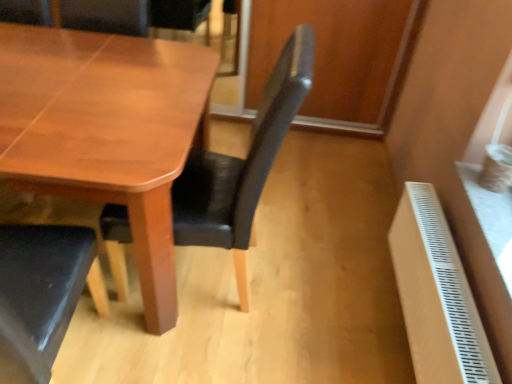
Question: Is wooden table at center facing away from satin black chair at center?

Choices:
 (A) no
 (B) yes

Answer: (A)

Question: From a real-world perspective, is wooden table at center located higher than satin black chair at center?

Choices:
 (A) yes
 (B) no

Answer: (B)

Question: Considering the relative positions of wooden table at center and satin black chair at center in the image provided, is wooden table at center to the left of satin black chair at center from the viewer's perspective?

Choices:
 (A) no
 (B) yes

Answer: (B)

Question: Can you confirm if wooden table at center is positioned to the right of satin black chair at center?

Choices:
 (A) no
 (B) yes

Answer: (A)

Question: Is satin black chair at center surrounded by wooden table at center?

Choices:
 (A) yes
 (B) no

Answer: (A)

Question: Is satin black chair at center in front of or behind white plastic radiator at lower right in the image?

Choices:
 (A) front
 (B) behind

Answer: (A)

Question: From a real-world perspective, is satin black chair at center above or below white plastic radiator at lower right?

Choices:
 (A) above
 (B) below

Answer: (A)

Question: Choose the correct answer: Is satin black chair at center inside white plastic radiator at lower right or outside it?

Choices:
 (A) inside
 (B) outside

Answer: (B)

Question: Is point (286, 119) closer or farther from the camera than point (433, 271)?

Choices:
 (A) closer
 (B) farther

Answer: (A)

Question: In terms of size, does wooden table at center appear bigger or smaller than satin black chair at center?

Choices:
 (A) small
 (B) big

Answer: (B)

Question: Considering their positions, is wooden table at center located in front of or behind satin black chair at center?

Choices:
 (A) front
 (B) behind

Answer: (B)

Question: From a real-world perspective, is wooden table at center physically located above or below satin black chair at center?

Choices:
 (A) below
 (B) above

Answer: (A)

Question: Is wooden table at center wider or thinner than satin black chair at center?

Choices:
 (A) wide
 (B) thin

Answer: (A)

Question: In the image, is satin black chair at center positioned in front of or behind wooden table at center?

Choices:
 (A) front
 (B) behind

Answer: (A)

Question: Is satin black chair at center wider or thinner than wooden table at center?

Choices:
 (A) thin
 (B) wide

Answer: (A)